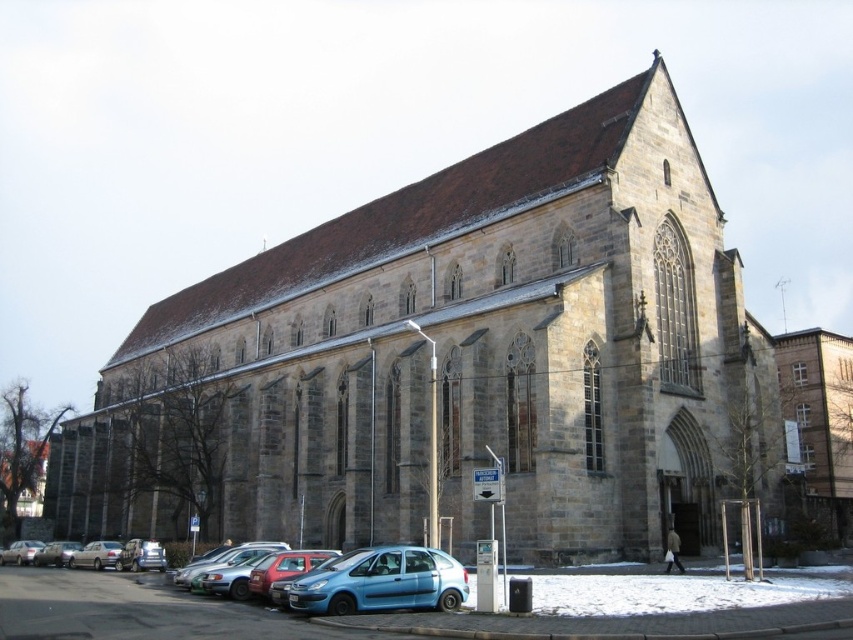
Is blue matte hatchback at lower center positioned behind matte silver car at lower left?

No, blue matte hatchback at lower center is in front of matte silver car at lower left.

Is point (375, 592) farther from camera compared to point (38, 548)?

No, (375, 592) is in front of (38, 548).

Between point (341, 580) and point (56, 564), which one is positioned in front?

Point (341, 580)

Identify the location of blue matte hatchback at lower center. (380, 580).

Does matte silver car at lower left appear over silver metallic car at lower left?

Yes, matte silver car at lower left is above silver metallic car at lower left.

Does matte silver car at lower left have a smaller size compared to silver metallic car at lower left?

Actually, matte silver car at lower left might be larger than silver metallic car at lower left.

Which is in front, point (51, 552) or point (35, 540)?

Point (51, 552)

Locate an element on the screen. The height and width of the screenshot is (640, 853). matte silver car at lower left is located at coordinates (55, 554).

Between stone church at center and silver metallic sedan at lower left, which one is positioned lower?

silver metallic sedan at lower left is below.

Is stone church at center thinner than silver metallic sedan at lower left?

No, stone church at center is not thinner than silver metallic sedan at lower left.

Describe the element at coordinates (457, 362) in the screenshot. The height and width of the screenshot is (640, 853). I see `stone church at center` at that location.

At what (x,y) coordinates should I click in order to perform the action: click on stone church at center. Please return your answer as a coordinate pair (x, y). Image resolution: width=853 pixels, height=640 pixels. Looking at the image, I should click on (457, 362).